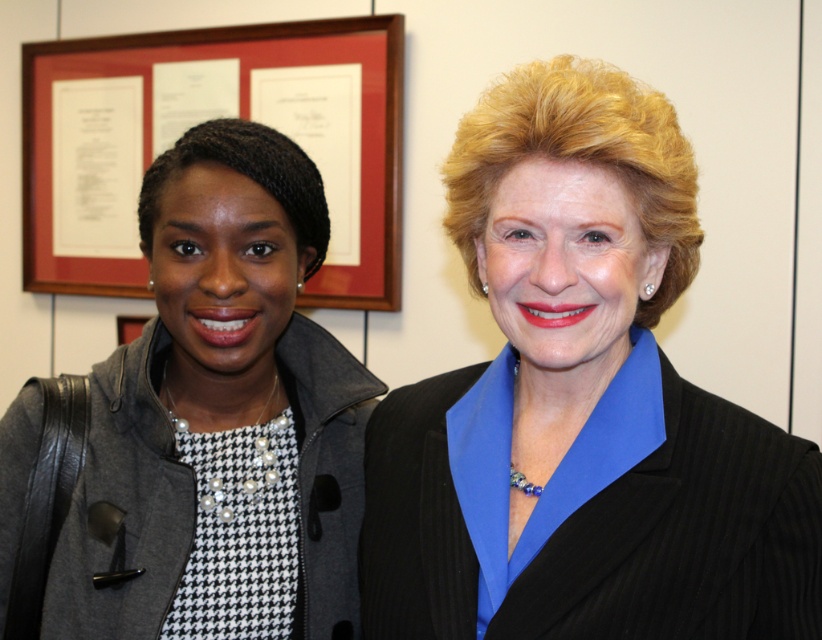
Does matte black blazer at center appear under wooden frame at upper left?

Yes, matte black blazer at center is below wooden frame at upper left.

Based on the photo, between matte black blazer at center and wooden frame at upper left, which one appears on the right side from the viewer's perspective?

matte black blazer at center is more to the right.

Does point (433, 401) lie behind point (48, 168)?

No, (433, 401) is in front of (48, 168).

At what (x,y) coordinates should I click in order to perform the action: click on matte black blazer at center. Please return your answer as a coordinate pair (x, y). This screenshot has width=822, height=640. Looking at the image, I should click on (580, 404).

Who is lower down, matte black blazer at center or matte black jacket at left?

matte black jacket at left

Between point (493, 636) and point (186, 456), which one is positioned in front?

Point (493, 636)

Which is in front, point (567, 552) or point (278, 148)?

Point (567, 552) is more forward.

Locate an element on the screen. Image resolution: width=822 pixels, height=640 pixels. matte black blazer at center is located at coordinates (580, 404).

Can you confirm if matte black jacket at left is bigger than wooden frame at upper left?

No.

Which is above, matte black jacket at left or wooden frame at upper left?

wooden frame at upper left is higher up.

Locate an element on the screen. The width and height of the screenshot is (822, 640). matte black jacket at left is located at coordinates (220, 417).